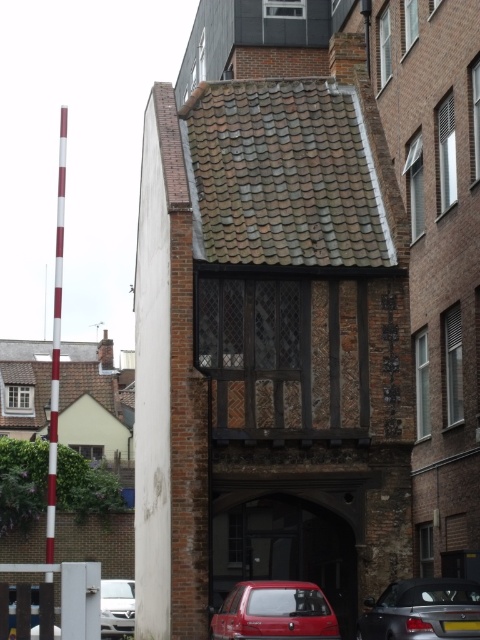
Is point (379, 627) farther from camera compared to point (280, 630)?

Yes, it is behind point (280, 630).

Locate an element on the screen. The image size is (480, 640). shiny black convertible at lower right is located at coordinates (422, 611).

Is matte red car at lower center thinner than white glossy car at lower left?

Indeed, matte red car at lower center has a lesser width compared to white glossy car at lower left.

Is matte red car at lower center shorter than white glossy car at lower left?

Yes, matte red car at lower center is shorter than white glossy car at lower left.

Locate an element on the screen. Image resolution: width=480 pixels, height=640 pixels. matte red car at lower center is located at coordinates (275, 612).

Is point (288, 563) behind point (386, 616)?

Yes, it is.

Is point (348, 525) positioned in front of point (477, 611)?

No, (348, 525) is behind (477, 611).

I want to click on metallic red car at center, so pyautogui.click(x=282, y=547).